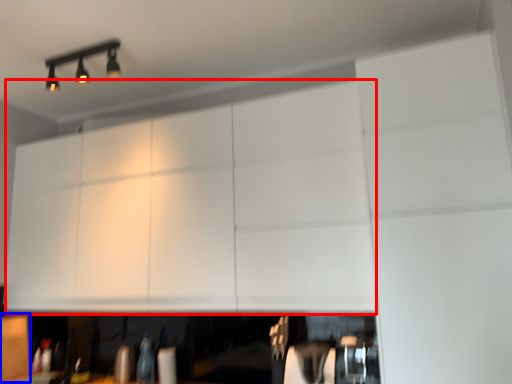
Question: Which object is closer to the camera taking this photo, cabinetry (highlighted by a red box) or cabinetry (highlighted by a blue box)?

Choices:
 (A) cabinetry
 (B) cabinetry

Answer: (A)